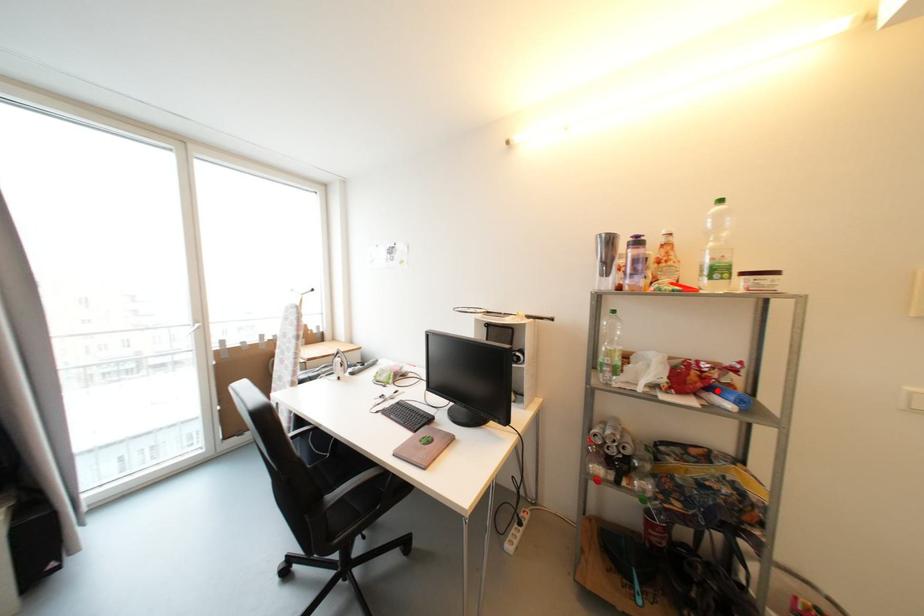
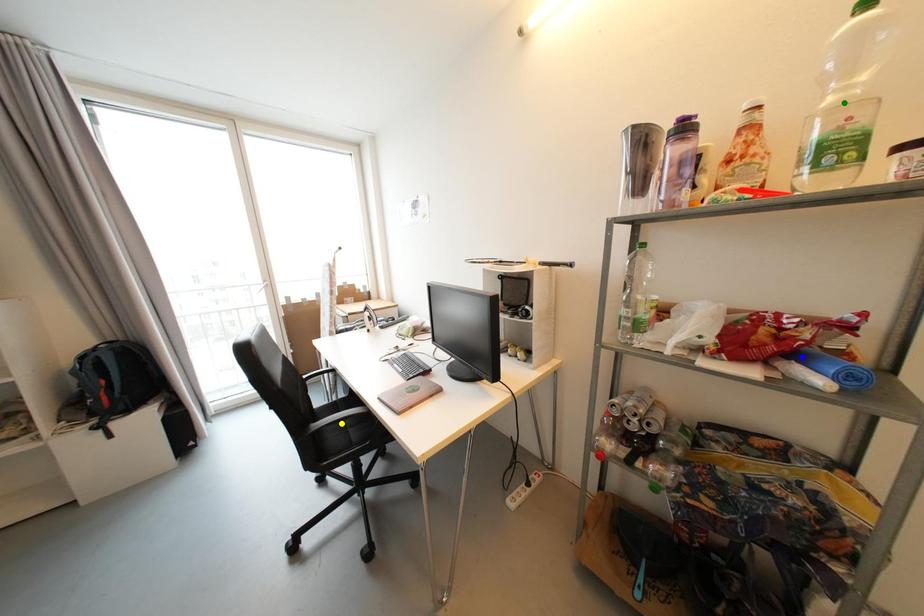
Question: I am providing you with two images of the same scene from different viewpoints. A red point is marked on the first image. You are given multiple points on the second image. Which point in image 2 represents the same 3d spot as the red point in image 1?

Choices:
 (A) yellow point
 (B) green point
 (C) blue point

Answer: (C)